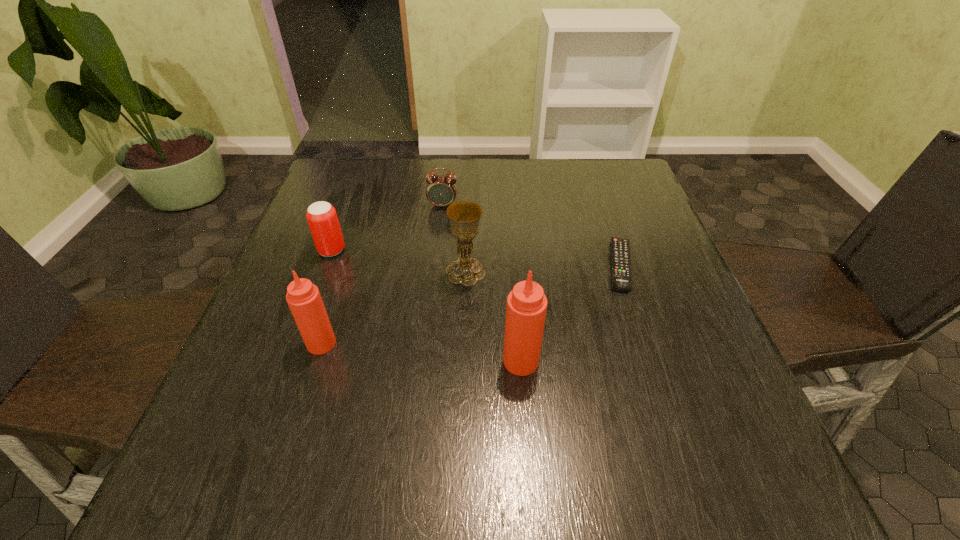
In the current image, all Tabasco sauces are evenly spaced. To maintain this equal spacing, where should an additional Tabasco sauce be placed on the right? Please point out a free spot. Please provide its 2D coordinates. Your answer should be formatted as a tuple, i.e. [(x, y)], where the tuple contains the x and y coordinates of a point satisfying the conditions above.

[(735, 380)]